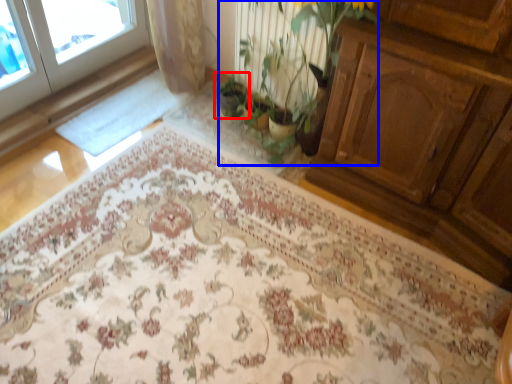
Question: Which point is closer to the camera, houseplant (highlighted by a red box) or floral arrangement (highlighted by a blue box)?

Choices:
 (A) houseplant
 (B) floral arrangement

Answer: (B)